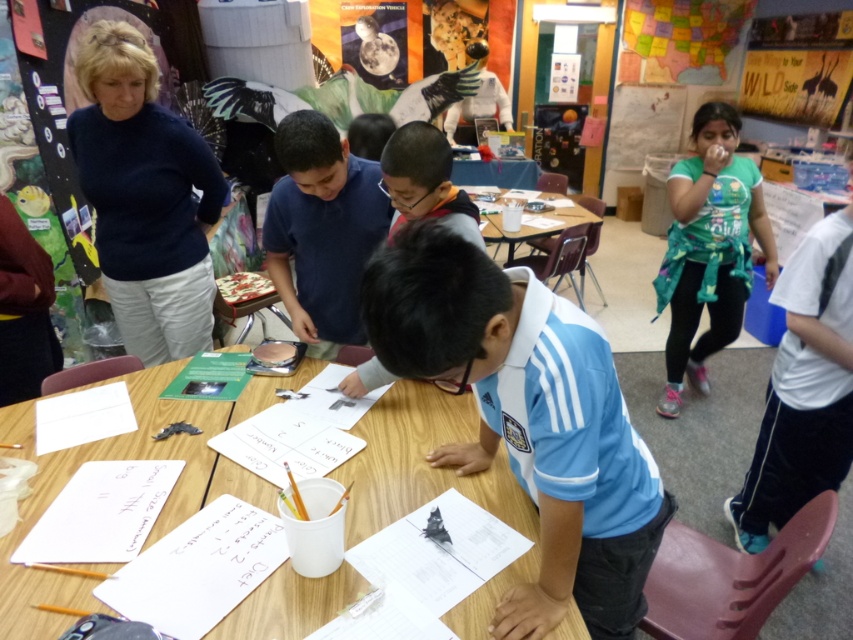
Question: Which point is farther from the camera taking this photo?

Choices:
 (A) click(x=71, y=598)
 (B) click(x=405, y=536)
 (C) click(x=202, y=566)
 (D) click(x=316, y=138)

Answer: (D)

Question: Can you confirm if blue jersey at center is bigger than blue cotton shirt at center?

Choices:
 (A) no
 (B) yes

Answer: (B)

Question: Can you confirm if blue jersey at center is thinner than wooden table at center?

Choices:
 (A) no
 (B) yes

Answer: (B)

Question: Estimate the real-world distances between objects in this image. Which object is closer to the blue jersey at center?

Choices:
 (A) white paper at lower left
 (B) white paper at lower center

Answer: (B)

Question: Is blue jersey at center bigger than white matte paper at lower center?

Choices:
 (A) yes
 (B) no

Answer: (A)

Question: Based on their relative distances, which object is nearer to the white paper at lower left?

Choices:
 (A) white paper at center
 (B) white paper at lower center
 (C) white matte paper at lower center

Answer: (A)